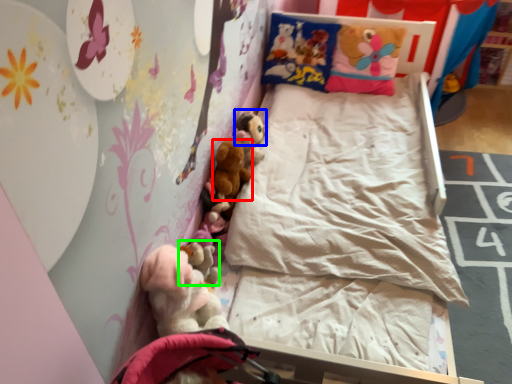
Question: Which object is positioned closest to toy (highlighted by a red box)? Select from toy (highlighted by a blue box) and toy (highlighted by a green box).

Choices:
 (A) toy
 (B) toy

Answer: (A)